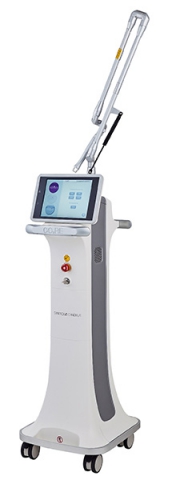
This screenshot has height=480, width=176. Find the location of `speaker`. speaker is located at coordinates (97, 255).